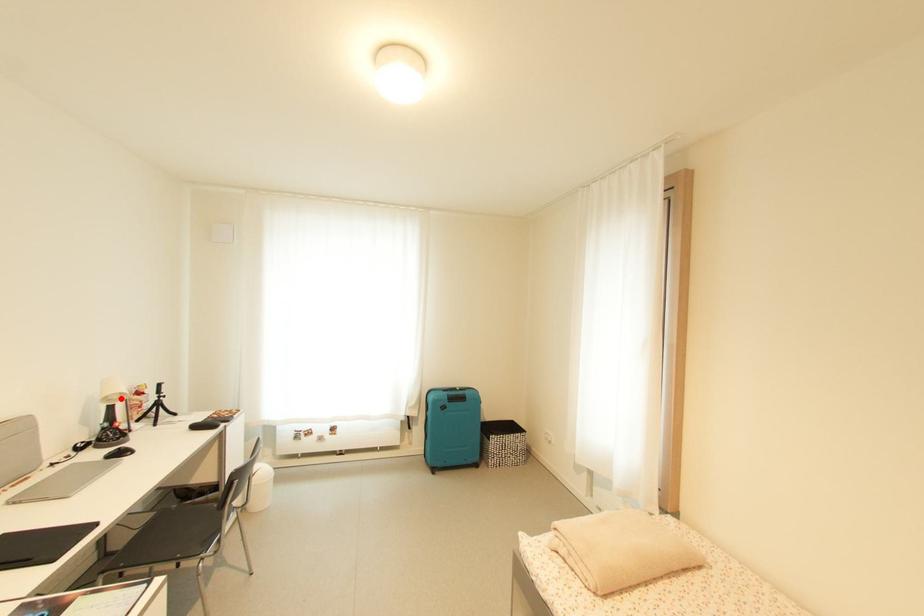
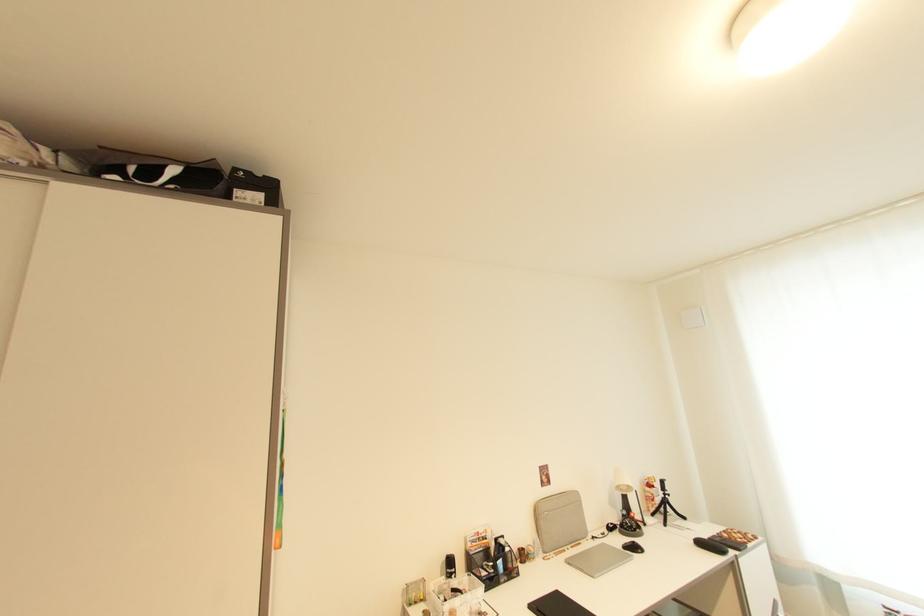
Find the pixel in the second image that matches the highlighted location in the first image.

(629, 490)